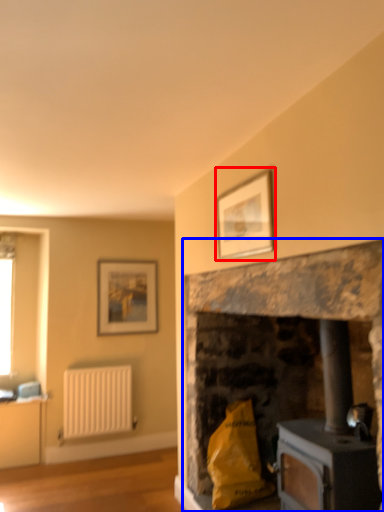
Question: Which of the following is the farthest to the observer, picture frame (highlighted by a red box) or fireplace (highlighted by a blue box)?

Choices:
 (A) picture frame
 (B) fireplace

Answer: (A)